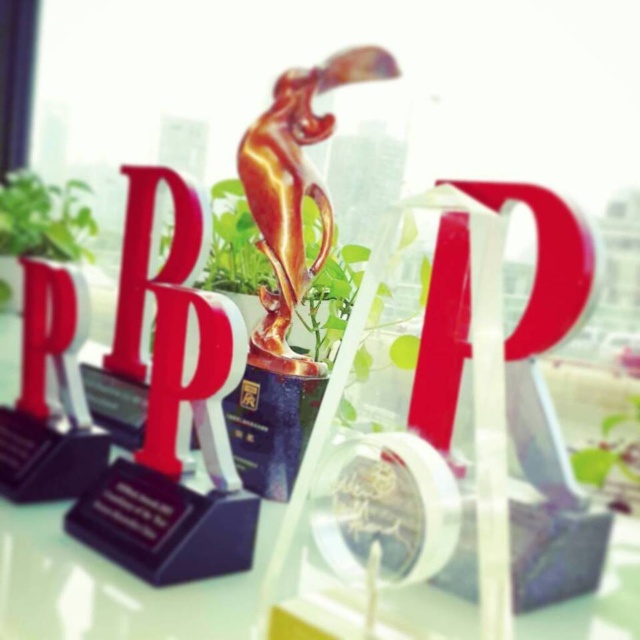
You are an archivist organizing a display. You need to place a new label next to the matte plastic letter p at center right. Where should you place it?

You should place the new label near the coordinates point (545, 262) where the matte plastic letter p at center right is located.

What is the object located at the coordinates point (x=148, y=257) in the image?

The object at point (x=148, y=257) is the red plastic letter b at center.

You are an interior designer arranging awards on a table. You need to place a new award between the red plastic letter b at center and the green leafy plant at center. Which object should the new award be closer to if it needs to be placed closer to the one that is nearer to you?

The red plastic letter b at center is closer to you than the green leafy plant at center. Therefore, the new award should be placed closer to the red plastic letter b at center.